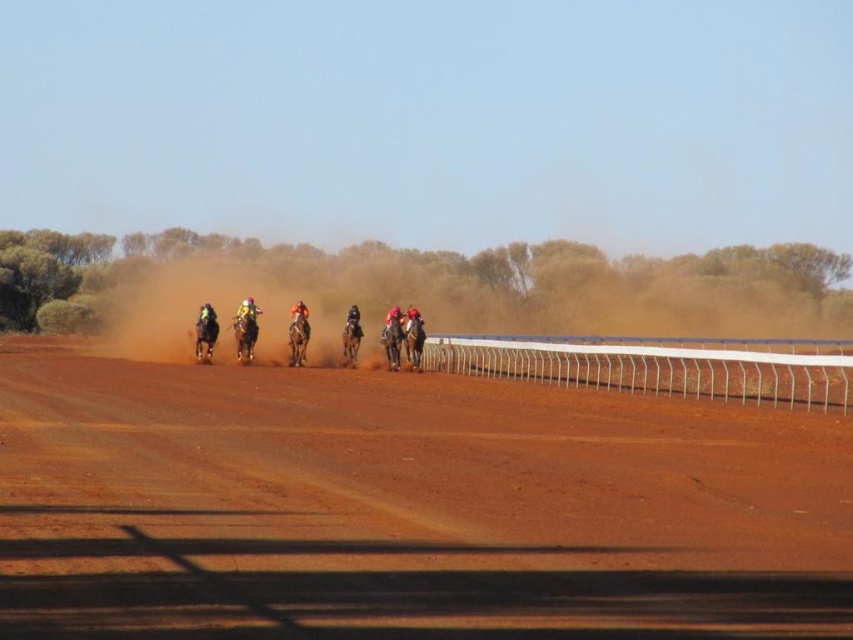
Between dusty reddish-brown dirt track at center and orange fabric rider at center, which one appears on the right side from the viewer's perspective?

dusty reddish-brown dirt track at center is more to the right.

Measure the distance from dusty reddish-brown dirt track at center to orange fabric rider at center.

dusty reddish-brown dirt track at center and orange fabric rider at center are 16.56 meters apart from each other.

What do you see at coordinates (405, 508) in the screenshot?
I see `dusty reddish-brown dirt track at center` at bounding box center [405, 508].

The width and height of the screenshot is (853, 640). What are the coordinates of `dusty reddish-brown dirt track at center` in the screenshot? It's located at (405, 508).